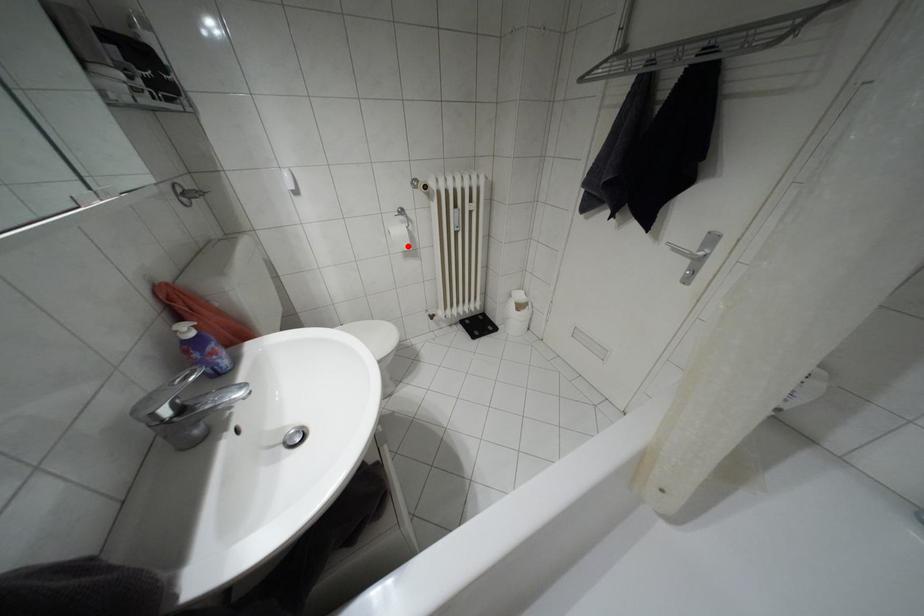
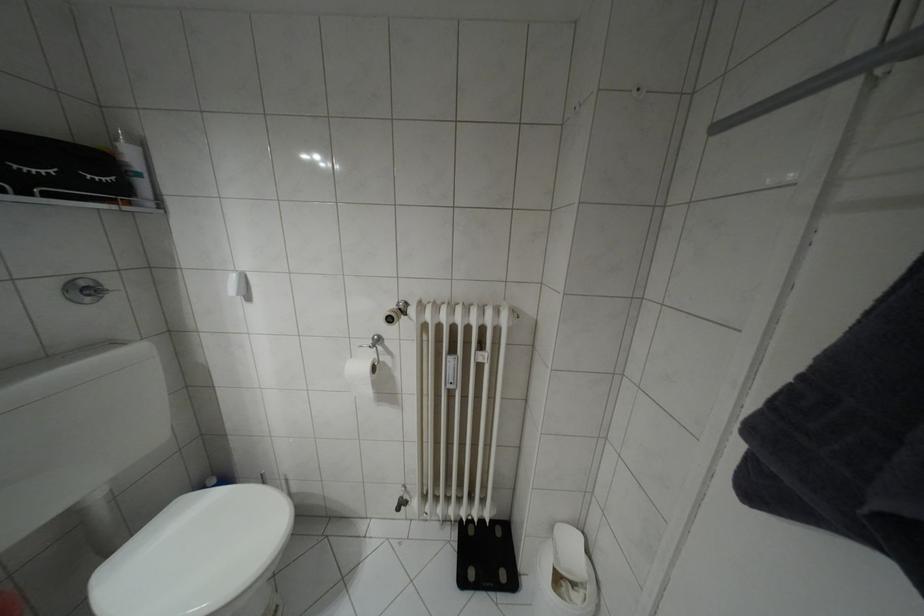
The point at the highlighted location is marked in the first image. Where is the corresponding point in the second image?

(369, 392)